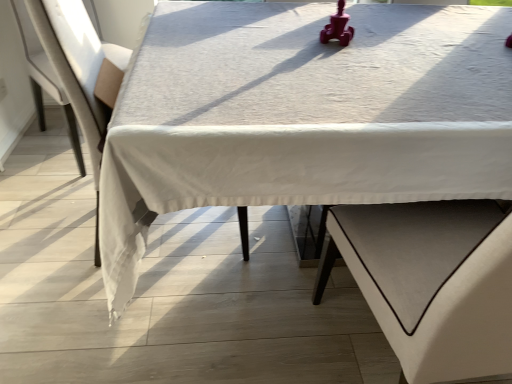
Locate an element on the screen. The width and height of the screenshot is (512, 384). white fabric table at center is located at coordinates (303, 115).

What do you see at coordinates (303, 115) in the screenshot?
I see `white fabric table at center` at bounding box center [303, 115].

Identify the location of white fabric armchair at left. (80, 74).

What do you see at coordinates (80, 74) in the screenshot? I see `white fabric armchair at left` at bounding box center [80, 74].

The height and width of the screenshot is (384, 512). Find the location of `white fabric table at center`. white fabric table at center is located at coordinates (303, 115).

Based on the photo, is white fabric table at center to the right of white fabric armchair at left from the viewer's perspective?

Yes.

In the scene shown: Considering the positions of objects white fabric table at center and white fabric armchair at left in the image provided, who is behind, white fabric table at center or white fabric armchair at left?

white fabric armchair at left is more distant.

Is point (490, 136) closer or farther from the camera than point (59, 0)?

Point (490, 136).

From the image's perspective, between white fabric table at center and white fabric armchair at left, which one is located above?

From the image's view, white fabric armchair at left is above.

From a real-world perspective, is white fabric table at center positioned above or below white fabric armchair at left?

In terms of real-world spatial position, white fabric table at center is below white fabric armchair at left.

Does white fabric table at center have a lesser width compared to white fabric armchair at left?

Incorrect, the width of white fabric table at center is not less than that of white fabric armchair at left.

Who is shorter, white fabric table at center or white fabric armchair at left?

white fabric table at center is shorter.

Does white fabric table at center have a larger size compared to white fabric armchair at left?

Correct, white fabric table at center is larger in size than white fabric armchair at left.

Is white fabric table at center inside or outside of white fabric armchair at left?

white fabric table at center is spatially situated outside white fabric armchair at left.

Does white fabric table at center touch white fabric armchair at left?

No, white fabric table at center is not next to white fabric armchair at left.

Could you tell me if white fabric table at center is turned towards white fabric armchair at left?

No.

How many degrees apart are the facing directions of white fabric table at center and white fabric armchair at left?

The angle between the facing direction of white fabric table at center and the facing direction of white fabric armchair at left is 92.4 degrees.

How much distance is there between white fabric table at center and white fabric armchair at left?

18.08 inches.

Identify the location of armchair located on the left of white fabric table at center. (80, 74).

Which object is positioned more to the left, white fabric armchair at left or white fabric table at center?

white fabric armchair at left.

Between white fabric armchair at left and white fabric table at center, which one is positioned in front?

white fabric table at center is in front.

Between point (61, 25) and point (181, 52), which one is positioned in front?

The point (61, 25) is in front.

From the image's perspective, relative to white fabric table at center, is white fabric armchair at left above or below?

Clearly, from the image's perspective, white fabric armchair at left is above white fabric table at center.

Based on the photo, from a real-world perspective, is white fabric armchair at left on white fabric table at center?

Yes, from a real-world perspective, white fabric armchair at left is on top of white fabric table at center.

Between white fabric armchair at left and white fabric table at center, which one has smaller width?

white fabric armchair at left.

Is white fabric armchair at left shorter than white fabric table at center?

Incorrect, the height of white fabric armchair at left does not fall short of that of white fabric table at center.

Based on their sizes in the image, would you say white fabric armchair at left is bigger or smaller than white fabric table at center?

Clearly, white fabric armchair at left is smaller in size than white fabric table at center.

Is white fabric armchair at left located outside white fabric table at center?

No, white fabric armchair at left is inside white fabric table at center's boundary.

Is white fabric armchair at left in contact with white fabric table at center?

No, white fabric armchair at left is not beside white fabric table at center.

Is white fabric armchair at left oriented away from white fabric table at center?

No.

How many degrees apart are the facing directions of white fabric armchair at left and white fabric table at center?

The angular difference between white fabric armchair at left and white fabric table at center is 92.4 degrees.

Locate an element on the screen. Image resolution: width=512 pixels, height=384 pixels. table below the white fabric armchair at left (from the image's perspective) is located at coordinates (303, 115).

You are a GUI agent. You are given a task and a screenshot of the screen. Output one action in this format:
    pyautogui.click(x=<x>, y=<y>)
    Task: Click on the armchair on the left side of white fabric table at center
    
    Given the screenshot: What is the action you would take?
    pyautogui.click(x=80, y=74)

Find the location of a particular element. This screenshot has height=384, width=512. table that is in front of the white fabric armchair at left is located at coordinates (303, 115).